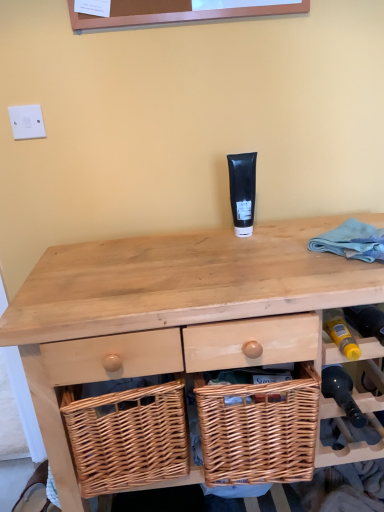
Where is `free spot to the right of black matte tube at center`? The height and width of the screenshot is (512, 384). free spot to the right of black matte tube at center is located at coordinates (297, 228).